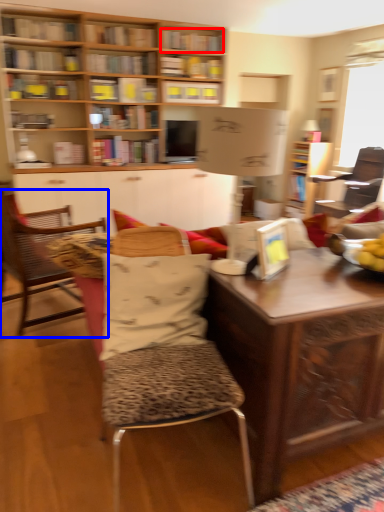
Question: Which point is further to the camera, book (highlighted by a red box) or chair (highlighted by a blue box)?

Choices:
 (A) book
 (B) chair

Answer: (A)